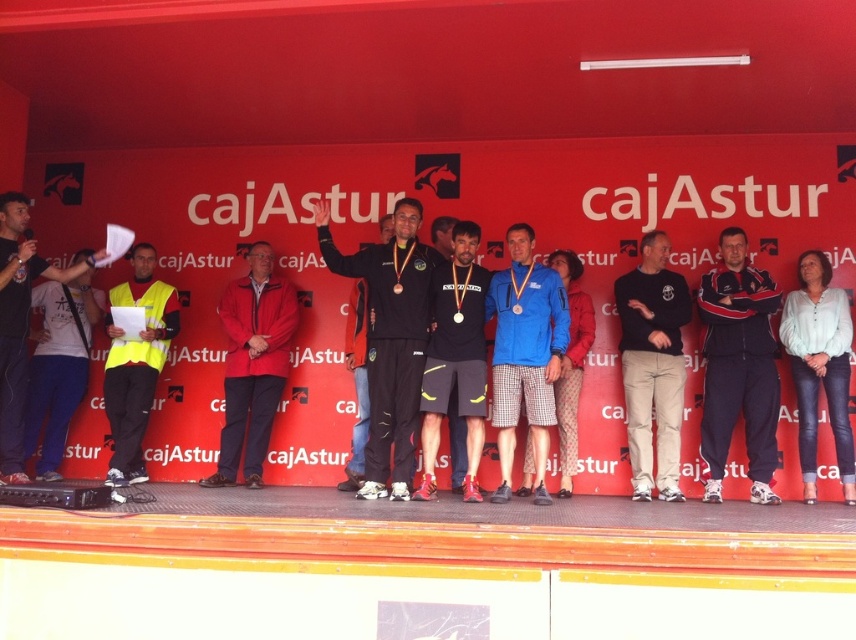
Who is higher up, matte black tracksuit at center or yellow reflective vest at left?

matte black tracksuit at center

Does matte black tracksuit at center have a greater height compared to yellow reflective vest at left?

Correct, matte black tracksuit at center is much taller as yellow reflective vest at left.

Where is `matte black tracksuit at center`? The image size is (856, 640). matte black tracksuit at center is located at coordinates (389, 339).

Does point (776, 445) come farther from viewer compared to point (251, 442)?

No.

Between dark blue tracksuit at center and red matte jacket at center, which one is positioned lower?

red matte jacket at center

This screenshot has width=856, height=640. What are the coordinates of `dark blue tracksuit at center` in the screenshot? It's located at (738, 365).

This screenshot has width=856, height=640. In order to click on dark blue tracksuit at center in this screenshot , I will do `click(738, 365)`.

Does black cotton pants at center appear over blue fabric shorts at center?

No, black cotton pants at center is not above blue fabric shorts at center.

Who is shorter, black cotton pants at center or blue fabric shorts at center?

blue fabric shorts at center is shorter.

Does point (629, 404) come in front of point (535, 339)?

No, (629, 404) is behind (535, 339).

Locate an element on the screen. black cotton pants at center is located at coordinates (652, 365).